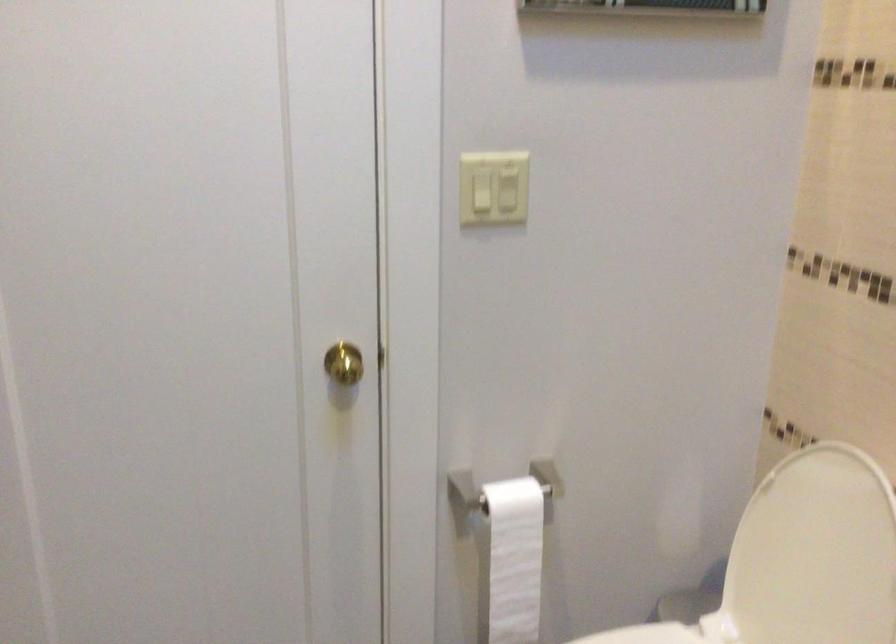
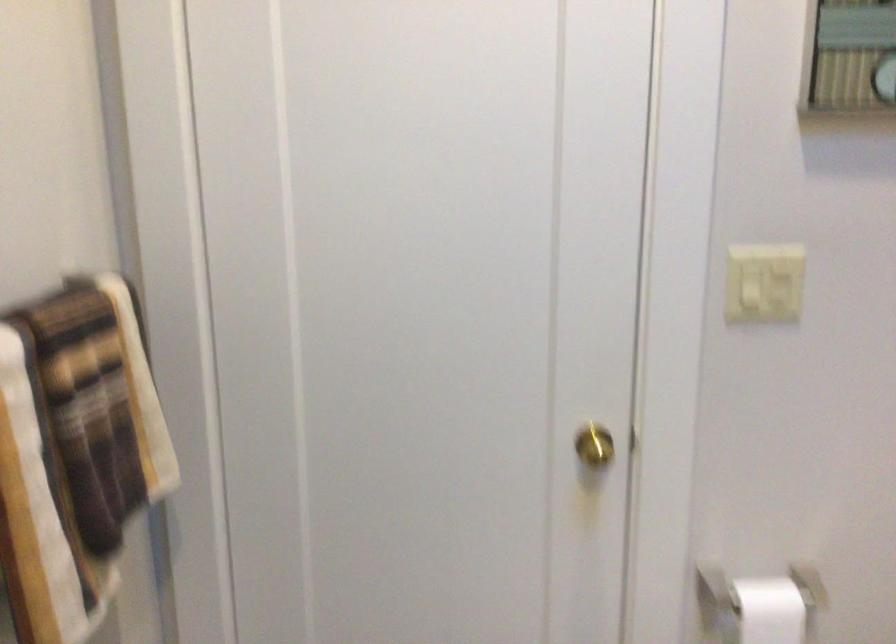
Question: Which direction would the cameraman need to move to produce the second image? Reply with the corresponding letter.

Choices:
 (A) Left
 (B) Right
 (C) Forward
 (D) Backward

Answer: (D)